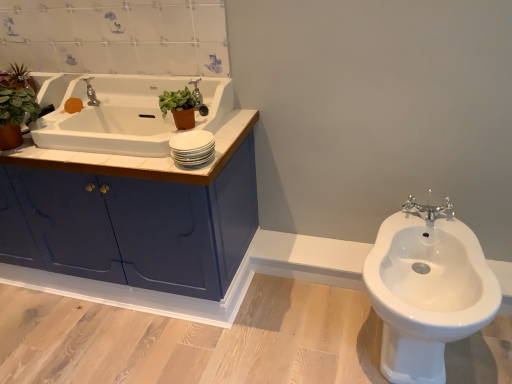
Measure the distance between orange matte soap at upper left and camera.

1.72 meters.

What is the approximate height of chrome metallic tap at upper left, which ranks as the 2th tap in bottom-to-top order?

4.45 inches.

The width and height of the screenshot is (512, 384). Describe the element at coordinates (91, 93) in the screenshot. I see `chrome metallic tap at upper left, placed as the first tap when sorted from left to right` at that location.

You are a GUI agent. You are given a task and a screenshot of the screen. Output one action in this format:
    pyautogui.click(x=<x>, y=<y>)
    Task: Click on the white wood counter top at upper left
    The height and width of the screenshot is (384, 512).
    Given the screenshot: What is the action you would take?
    pyautogui.click(x=140, y=157)

This screenshot has height=384, width=512. Find the location of `orange matte soap at upper left`. orange matte soap at upper left is located at coordinates (73, 105).

Considering the positions of objects white glossy bidet at right and chrome metallic tap at right, which is the second tap from left to right, in the image provided, who is more to the right, white glossy bidet at right or chrome metallic tap at right, which is the second tap from left to right,?

chrome metallic tap at right, which is the second tap from left to right, is more to the right.

From the image's perspective, is white glossy bidet at right located beneath chrome metallic tap at right, positioned as the 2th tap in top-to-bottom order?

Yes, from the image's perspective, white glossy bidet at right is beneath chrome metallic tap at right, positioned as the 2th tap in top-to-bottom order.

Which is in front, point (466, 331) or point (446, 213)?

The point (466, 331) is in front.

From a real-world perspective, is chrome metallic tap at upper left, placed as the 1th tap when sorted from top to bottom, located beneath white glossy bidet at right?

Actually, chrome metallic tap at upper left, placed as the 1th tap when sorted from top to bottom, is physically above white glossy bidet at right in the real world.

From the image's perspective, is chrome metallic tap at upper left, the second tap viewed from the right, located above or below white glossy bidet at right?

chrome metallic tap at upper left, the second tap viewed from the right, is situated higher than white glossy bidet at right in the image.

In terms of width, does chrome metallic tap at upper left, which is counted as the 1th tap, starting from the back, look wider or thinner when compared to white glossy bidet at right?

Clearly, chrome metallic tap at upper left, which is counted as the 1th tap, starting from the back, has less width compared to white glossy bidet at right.

Does chrome metallic tap at upper left, placed as the 1th tap when sorted from top to bottom, appear on the right side of white glossy bidet at right?

No.

At what (x,y) coordinates should I click in order to perform the action: click on soap above the white glossy bidet at right (from the image's perspective). Please return your answer as a coordinate pair (x, y). Looking at the image, I should click on (73, 105).

Is white glossy bidet at right next to orange matte soap at upper left and touching it?

white glossy bidet at right and orange matte soap at upper left are not in contact.

Is white glossy bidet at right to the right of orange matte soap at upper left from the viewer's perspective?

Indeed, white glossy bidet at right is positioned on the right side of orange matte soap at upper left.

Would you say white glossy bidet at right is inside or outside orange matte soap at upper left?

white glossy bidet at right is spatially situated outside orange matte soap at upper left.

Is white wood counter top at upper left with white glossy bidet at right?

No, white wood counter top at upper left is not touching white glossy bidet at right.

Where is `counter top lying behind the white glossy bidet at right`? This screenshot has height=384, width=512. counter top lying behind the white glossy bidet at right is located at coordinates (140, 157).

Would you say white wood counter top at upper left is outside white glossy bidet at right?

white wood counter top at upper left lies outside white glossy bidet at right's area.

Which object is positioned more to the left, white wood counter top at upper left or white glossy bidet at right?

Positioned to the left is white wood counter top at upper left.

Is chrome metallic tap at upper left, placed as the 1th tap when sorted from top to bottom, oriented away from chrome metallic tap at right, the 1th tap positioned from the right?

chrome metallic tap at upper left, placed as the 1th tap when sorted from top to bottom, is not turned away from chrome metallic tap at right, the 1th tap positioned from the right.

From the picture: Is chrome metallic tap at upper left, placed as the 1th tap when sorted from top to bottom, to the left or to the right of chrome metallic tap at right, positioned as the 2th tap in top-to-bottom order, in the image?

chrome metallic tap at upper left, placed as the 1th tap when sorted from top to bottom, is positioned on chrome metallic tap at right, positioned as the 2th tap in top-to-bottom order,'s left side.

From a real-world perspective, is chrome metallic tap at upper left, placed as the first tap when sorted from left to right, located higher than chrome metallic tap at right, positioned as the 2th tap in top-to-bottom order?

Indeed, from a real-world perspective, chrome metallic tap at upper left, placed as the first tap when sorted from left to right, stands above chrome metallic tap at right, positioned as the 2th tap in top-to-bottom order.

From the image's perspective, which one is positioned lower, chrome metallic tap at right, which is the first tap in bottom-to-top order, or chrome metallic tap at upper left, placed as the first tap when sorted from left to right?

chrome metallic tap at right, which is the first tap in bottom-to-top order, appears lower in the image.

This screenshot has height=384, width=512. Identify the location of tap below the chrome metallic tap at upper left, which ranks as the 2th tap in bottom-to-top order (from the image's perspective). (429, 209).

Can you confirm if chrome metallic tap at right, the 1th tap positioned from the right, is smaller than chrome metallic tap at upper left, the second tap viewed from the right?

No.

Based on the photo, which is behind, orange matte soap at upper left or green matte plant at upper center, which is the 1th plant from right to left?

orange matte soap at upper left is behind.

Looking at this image, considering the sizes of orange matte soap at upper left and green matte plant at upper center, the second plant when ordered from back to front, in the image, is orange matte soap at upper left taller or shorter than green matte plant at upper center, the second plant when ordered from back to front,?

Clearly, orange matte soap at upper left is shorter compared to green matte plant at upper center, the second plant when ordered from back to front.

Could you tell me if orange matte soap at upper left is facing green matte plant at upper center, which is the 1th plant from right to left?

No, orange matte soap at upper left is not aimed at green matte plant at upper center, which is the 1th plant from right to left.

At what (x,y) coordinates should I click in order to perform the action: click on toilet below the chrome metallic tap at right, positioned as the 2th tap in top-to-bottom order (from the image's perspective). Please return your answer as a coordinate pair (x, y). Looking at the image, I should click on (426, 289).

The image size is (512, 384). In order to click on toilet that appears on the right of chrome metallic tap at upper left, which ranks as the 2th tap in bottom-to-top order in this screenshot , I will do `click(426, 289)`.

Based on their spatial positions, is orange matte soap at upper left or green matte plant at upper left, positioned as the second plant in right-to-left order, closer to chrome metallic tap at upper left, which ranks as the 2th tap in bottom-to-top order?

orange matte soap at upper left is positioned closer to the anchor chrome metallic tap at upper left, which ranks as the 2th tap in bottom-to-top order.

Considering their positions, is white glossy bidet at right positioned closer to chrome metallic tap at right, which is the second tap from left to right, than green matte plant at upper center, which is counted as the second plant, starting from the left?

white glossy bidet at right lies closer to chrome metallic tap at right, which is the second tap from left to right, than the other object.

Which object lies nearer to the anchor point blue glossy cabinet at left, green matte plant at upper center, the second plant when ordered from back to front, or orange matte soap at upper left?

→ The object closer to blue glossy cabinet at left is green matte plant at upper center, the second plant when ordered from back to front.

Considering their positions, is chrome metallic tap at right, which is the second tap from left to right, positioned further to white wood counter top at upper left than blue glossy cabinet at left?

chrome metallic tap at right, which is the second tap from left to right, is further to white wood counter top at upper left.

Based on their spatial positions, is white wood counter top at upper left or green matte plant at upper left, which appears as the first plant when viewed from the back, closer to green matte plant at upper center, marked as the first plant in a front-to-back arrangement?

white wood counter top at upper left.

Estimate the real-world distances between objects in this image. Which object is closer to green matte plant at upper center, the second plant when ordered from back to front, orange matte soap at upper left or chrome metallic tap at right, which is the first tap in bottom-to-top order?

orange matte soap at upper left lies closer to green matte plant at upper center, the second plant when ordered from back to front, than the other object.

Looking at the image, which one is located closer to white glossy bidet at right, orange matte soap at upper left or green matte plant at upper left, which appears as the first plant when viewed from the back?

orange matte soap at upper left.

From the picture: Considering their positions, is green matte plant at upper center, which is counted as the second plant, starting from the left, positioned further to green matte plant at upper left, which is counted as the 1th plant, starting from the left, than white wood counter top at upper left?

green matte plant at upper center, which is counted as the second plant, starting from the left, lies further to green matte plant at upper left, which is counted as the 1th plant, starting from the left, than the other object.

You are a GUI agent. You are given a task and a screenshot of the screen. Output one action in this format:
    pyautogui.click(x=<x>, y=<y>)
    Task: Click on the bathroom cabinet between green matte plant at upper left, arranged as the second plant when viewed from the front, and white glossy bidet at right
    Image resolution: width=512 pixels, height=384 pixels.
    Given the screenshot: What is the action you would take?
    pyautogui.click(x=154, y=164)

The height and width of the screenshot is (384, 512). I want to click on counter top between blue glossy cabinet at left and orange matte soap at upper left from front to back, so click(x=140, y=157).

Find the location of a particular element. The height and width of the screenshot is (384, 512). counter top located between green matte plant at upper left, which is counted as the 1th plant, starting from the left, and white glossy bidet at right in the left-right direction is located at coordinates (140, 157).

The height and width of the screenshot is (384, 512). Find the location of `tap located between green matte plant at upper left, which appears as the first plant when viewed from the back, and green matte plant at upper center, the second plant when ordered from back to front, in the left-right direction`. tap located between green matte plant at upper left, which appears as the first plant when viewed from the back, and green matte plant at upper center, the second plant when ordered from back to front, in the left-right direction is located at coordinates (91, 93).